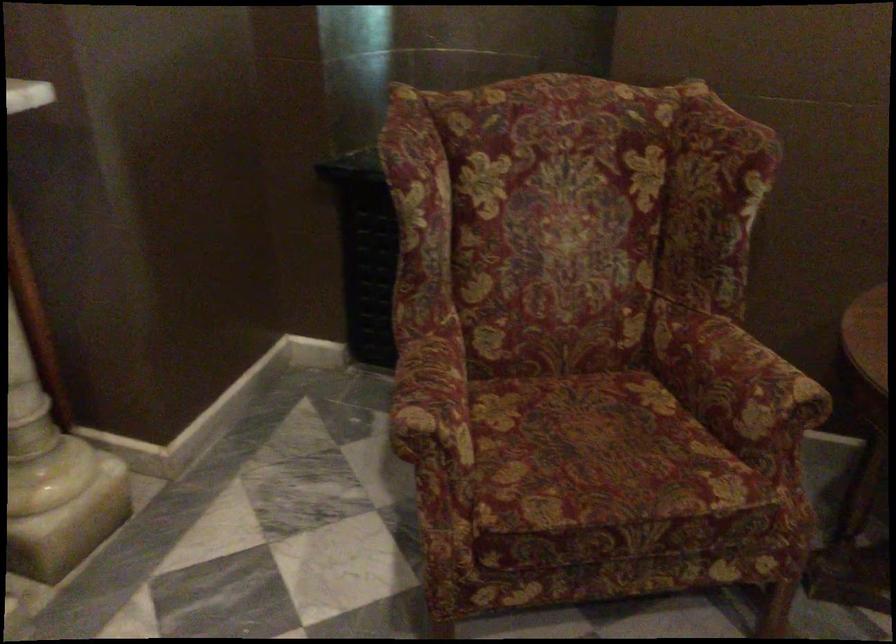
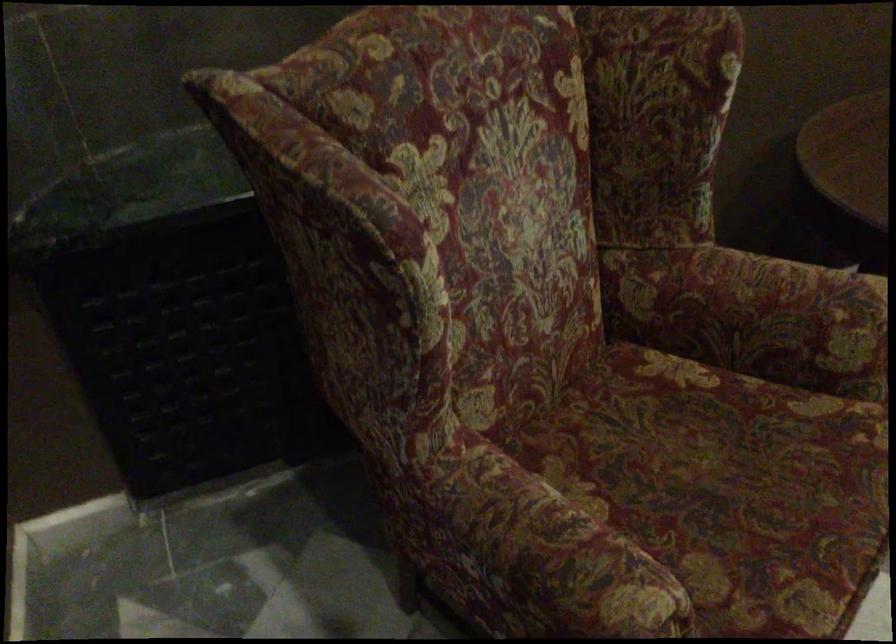
Where in the second image is the point corresponding to the point at 728,384 from the first image?

(786, 321)